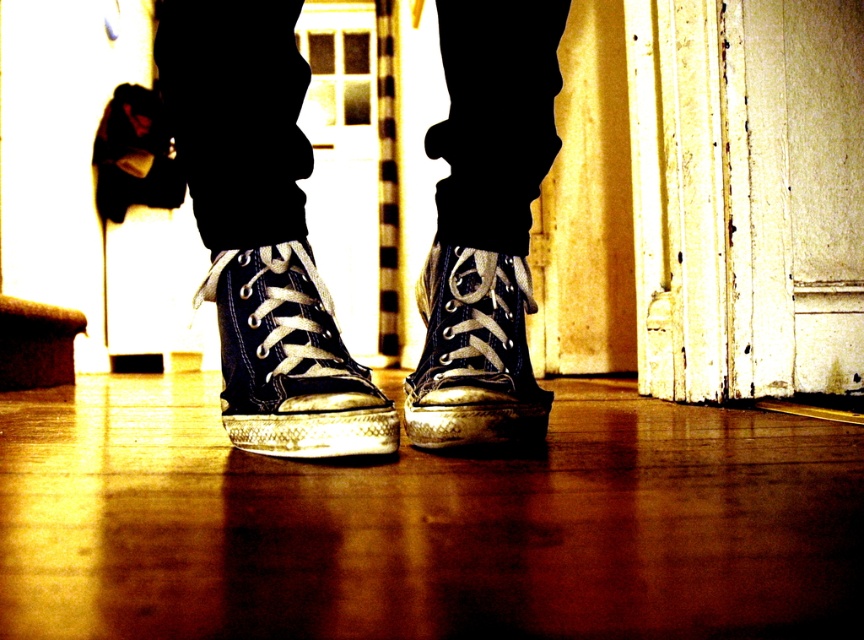
Can you confirm if matte canvas sneakers at center is wider than matte black sneaker at center?

Yes, matte canvas sneakers at center is wider than matte black sneaker at center.

Does point (252, 259) come in front of point (227, 401)?

Yes, point (252, 259) is in front of point (227, 401).

Find the location of a particular element. Image resolution: width=864 pixels, height=640 pixels. matte canvas sneakers at center is located at coordinates (261, 230).

Is matte canvas sneakers at center to the right of matte canvas sneaker at center from the viewer's perspective?

No, matte canvas sneakers at center is not to the right of matte canvas sneaker at center.

In the scene shown: Who is shorter, matte canvas sneakers at center or matte canvas sneaker at center?

Standing shorter between the two is matte canvas sneaker at center.

What do you see at coordinates (261, 230) in the screenshot?
I see `matte canvas sneakers at center` at bounding box center [261, 230].

Where is `matte canvas sneakers at center`? This screenshot has width=864, height=640. matte canvas sneakers at center is located at coordinates (261, 230).

Based on the photo, between checkerboard fabric door at center and matte canvas sneaker at center, which one is positioned higher?

checkerboard fabric door at center is higher up.

How distant is checkerboard fabric door at center from matte canvas sneaker at center?

They are 3.43 meters apart.

This screenshot has height=640, width=864. Find the location of `checkerboard fabric door at center`. checkerboard fabric door at center is located at coordinates 354,166.

What are the coordinates of `checkerboard fabric door at center` in the screenshot? It's located at (354, 166).